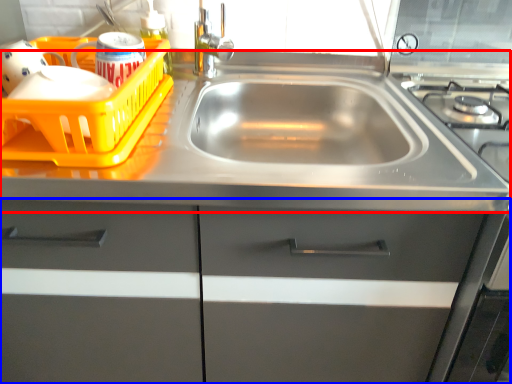
Question: Which point is closer to the camera, counter top (highlighted by a red box) or cabinetry (highlighted by a blue box)?

Choices:
 (A) counter top
 (B) cabinetry

Answer: (B)